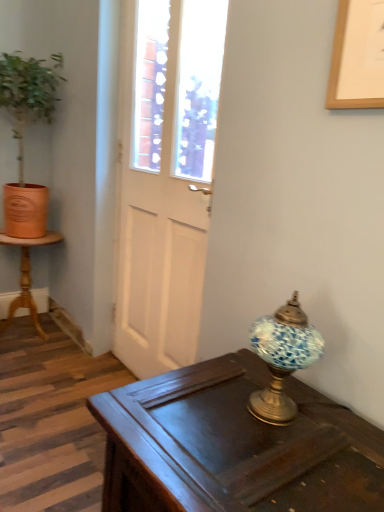
Locate an element on the screen. This screenshot has width=384, height=512. free spot to the left of blue mosaic glass lamp at right is located at coordinates (209, 408).